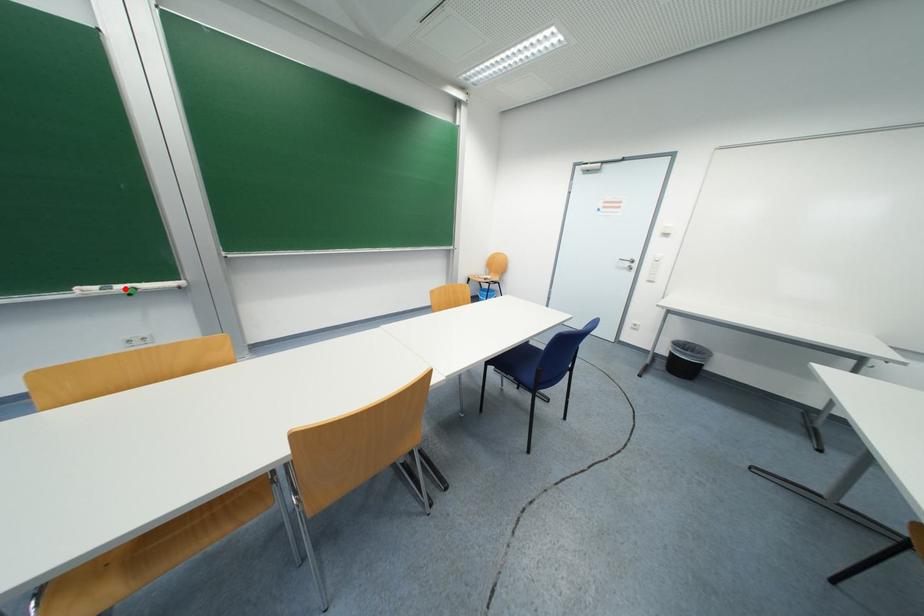
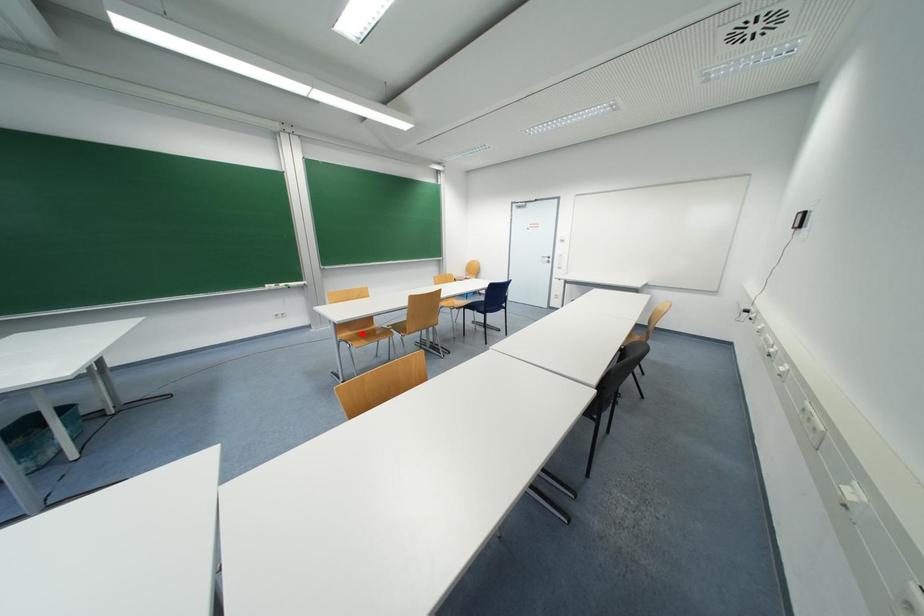
I am providing you with two images of the same scene from different viewpoints. A red point is marked on the first image and another point is marked on the second image. Are the points marked in image1 and image2 representing the same 3D position?

No